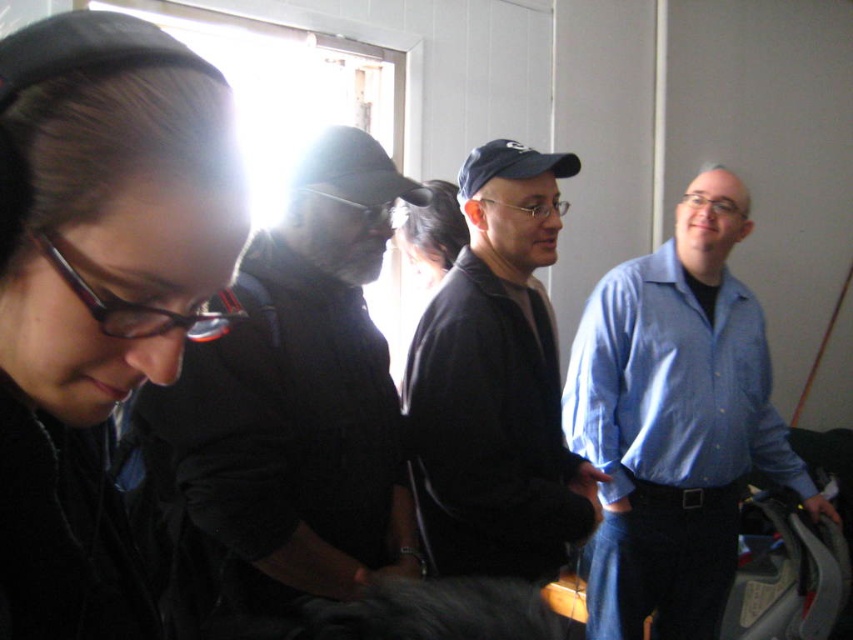
Question: Does black matte jacket at lower left come behind dark brown hair at center?

Choices:
 (A) no
 (B) yes

Answer: (A)

Question: Among these objects, which one is farthest from the camera?

Choices:
 (A) dark blue cap at center
 (B) black fabric baseball cap at center
 (C) blue shirt at right
 (D) dark brown hair at center

Answer: (D)

Question: Is dark blue cap at center below blue fabric baseball cap at center?

Choices:
 (A) no
 (B) yes

Answer: (B)

Question: Which point is farther to the camera?

Choices:
 (A) dark brown hair at center
 (B) dark blue cap at center

Answer: (A)

Question: Which object is the farthest from the blue fabric baseball cap at center?

Choices:
 (A) black matte jacket at lower left
 (B) black fabric baseball cap at center
 (C) blue shirt at right

Answer: (A)

Question: In this image, where is dark blue cap at center located relative to black fabric baseball cap at center?

Choices:
 (A) right
 (B) left

Answer: (A)